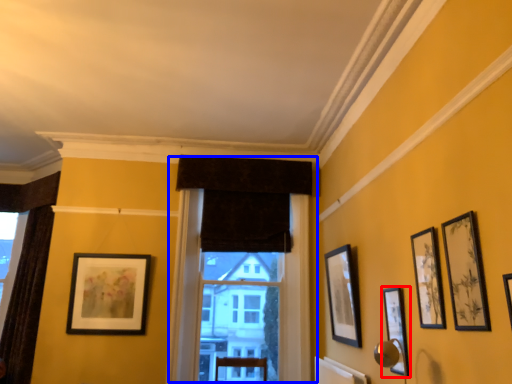
Question: Which point is further to the camera, picture frame (highlighted by a red box) or window (highlighted by a blue box)?

Choices:
 (A) picture frame
 (B) window

Answer: (B)